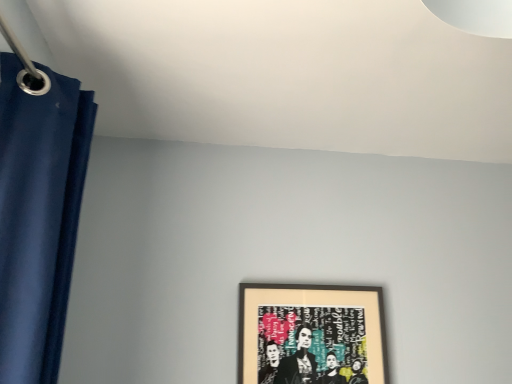
What is the approximate height of matte blue curtain at left?

matte blue curtain at left is 25.80 inches in height.

What do you see at coordinates (38, 217) in the screenshot?
I see `matte blue curtain at left` at bounding box center [38, 217].

Where is `matte blue curtain at left`? The image size is (512, 384). matte blue curtain at left is located at coordinates [38, 217].

This screenshot has width=512, height=384. Describe the element at coordinates (312, 334) in the screenshot. I see `wooden framed artwork at center` at that location.

Find the location of a particular element. This screenshot has width=512, height=384. wooden framed artwork at center is located at coordinates (312, 334).

You are a GUI agent. You are given a task and a screenshot of the screen. Output one action in this format:
    pyautogui.click(x=<x>, y=<y>)
    Task: Click on the matte blue curtain at left
    The height and width of the screenshot is (384, 512).
    Given the screenshot: What is the action you would take?
    pos(38,217)

Does wooden framed artwork at center appear on the right side of matte blue curtain at left?

Indeed, wooden framed artwork at center is positioned on the right side of matte blue curtain at left.

Considering the relative positions of wooden framed artwork at center and matte blue curtain at left in the image provided, is wooden framed artwork at center behind matte blue curtain at left?

Yes, the depth of wooden framed artwork at center is greater than that of matte blue curtain at left.

Which is less distant, (269, 374) or (7, 250)?

The point (7, 250) is closer to the camera.

From the image's perspective, which one is positioned higher, wooden framed artwork at center or matte blue curtain at left?

matte blue curtain at left.

From a real-world perspective, is wooden framed artwork at center beneath matte blue curtain at left?

Yes, from a real-world perspective, wooden framed artwork at center is below matte blue curtain at left.

Which of these two, wooden framed artwork at center or matte blue curtain at left, is thinner?

wooden framed artwork at center is thinner.

Which of these two, wooden framed artwork at center or matte blue curtain at left, stands shorter?

With less height is wooden framed artwork at center.

Looking at the image, does wooden framed artwork at center seem bigger or smaller compared to matte blue curtain at left?

wooden framed artwork at center is smaller than matte blue curtain at left.

Is wooden framed artwork at center inside the boundaries of matte blue curtain at left, or outside?

wooden framed artwork at center is spatially situated outside matte blue curtain at left.

Are wooden framed artwork at center and matte blue curtain at left making contact?

There is a gap between wooden framed artwork at center and matte blue curtain at left.

Could you tell me if wooden framed artwork at center is facing matte blue curtain at left?

No, wooden framed artwork at center is not oriented towards matte blue curtain at left.

Can you tell me how much wooden framed artwork at center and matte blue curtain at left differ in facing direction?

90.6 degrees.

This screenshot has width=512, height=384. In order to click on picture frame behind the matte blue curtain at left in this screenshot , I will do `click(312, 334)`.

Consider the image. Is matte blue curtain at left to the right of wooden framed artwork at center from the viewer's perspective?

Incorrect, matte blue curtain at left is not on the right side of wooden framed artwork at center.

Looking at this image, considering their positions, is matte blue curtain at left located in front of or behind wooden framed artwork at center?

Clearly, matte blue curtain at left is in front of wooden framed artwork at center.

Does point (14, 195) lie in front of point (248, 354)?

That is True.

From the image's perspective, is matte blue curtain at left above wooden framed artwork at center?

Yes, from the image's perspective, matte blue curtain at left is over wooden framed artwork at center.

From a real-world perspective, is matte blue curtain at left physically above wooden framed artwork at center?

Yes, from a real-world perspective, matte blue curtain at left is over wooden framed artwork at center

Is matte blue curtain at left wider than wooden framed artwork at center?

Correct, the width of matte blue curtain at left exceeds that of wooden framed artwork at center.

Can you confirm if matte blue curtain at left is shorter than wooden framed artwork at center?

No.

Considering the sizes of objects matte blue curtain at left and wooden framed artwork at center in the image provided, who is bigger, matte blue curtain at left or wooden framed artwork at center?

With larger size is matte blue curtain at left.

Does matte blue curtain at left contain wooden framed artwork at center?

No.

Is matte blue curtain at left next to wooden framed artwork at center?

No, matte blue curtain at left is not in contact with wooden framed artwork at center.

Is matte blue curtain at left turned away from wooden framed artwork at center?

That's not correct — matte blue curtain at left is not looking away from wooden framed artwork at center.

How many degrees apart are the facing directions of matte blue curtain at left and wooden framed artwork at center?

The facing directions of matte blue curtain at left and wooden framed artwork at center are 90.6 degrees apart.

Where is `curtain lying above the wooden framed artwork at center (from the image's perspective)`? The image size is (512, 384). curtain lying above the wooden framed artwork at center (from the image's perspective) is located at coordinates (38, 217).

Find the location of `picture frame below the matte blue curtain at left (from a real-world perspective)`. picture frame below the matte blue curtain at left (from a real-world perspective) is located at coordinates (312, 334).

This screenshot has height=384, width=512. Find the location of `picture frame on the right side of matte blue curtain at left`. picture frame on the right side of matte blue curtain at left is located at coordinates (312, 334).